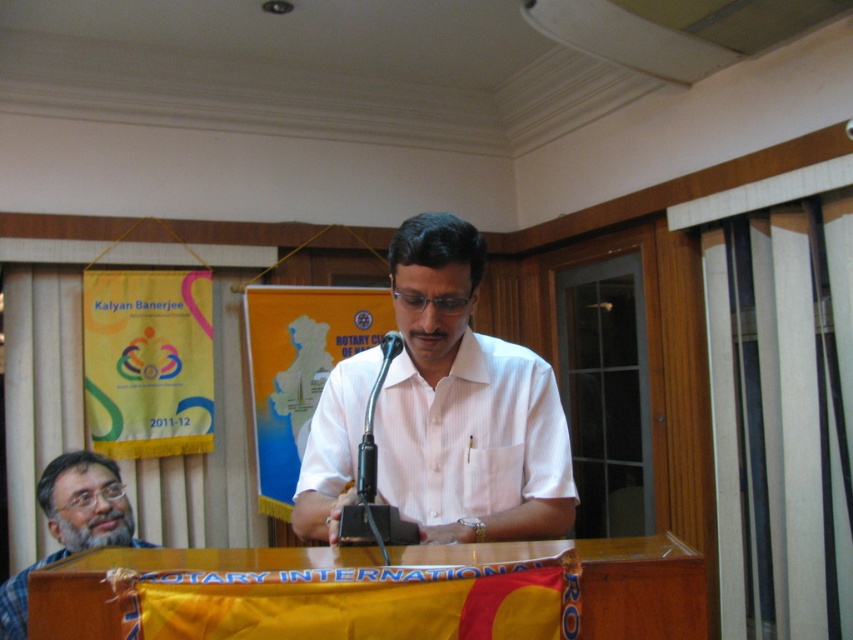
Question: Among these objects, which one is nearest to the camera?

Choices:
 (A) white striped shirt at center
 (B) black plastic microphone at center
 (C) gray checkered shirt at lower left

Answer: (B)

Question: In this image, where is white striped shirt at center located relative to gray checkered shirt at lower left?

Choices:
 (A) above
 (B) below

Answer: (A)

Question: Which point is closer to the camera?

Choices:
 (A) gray checkered shirt at lower left
 (B) black plastic microphone at center
 (C) white striped shirt at center

Answer: (B)

Question: Which of the following is the farthest from the observer?

Choices:
 (A) (467, 496)
 (B) (97, 509)
 (C) (396, 541)

Answer: (B)

Question: Does white striped shirt at center have a larger size compared to gray checkered shirt at lower left?

Choices:
 (A) yes
 (B) no

Answer: (B)

Question: Can you confirm if white striped shirt at center is wider than gray checkered shirt at lower left?

Choices:
 (A) yes
 (B) no

Answer: (A)